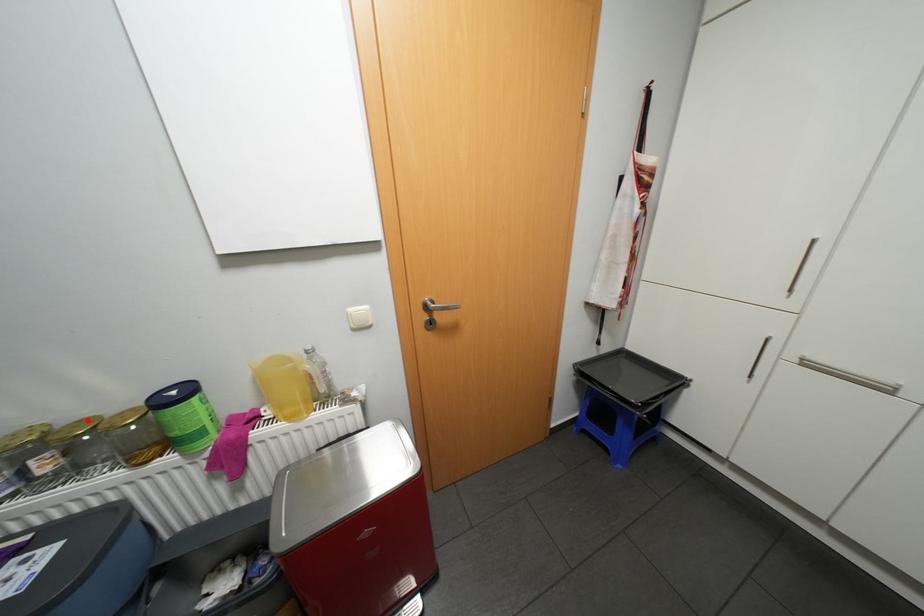
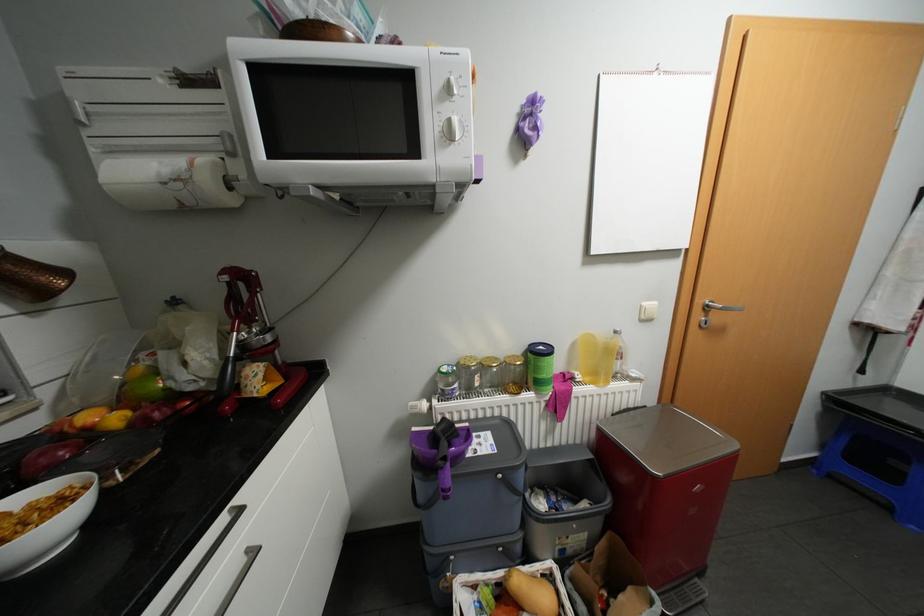
In the second image, find the point that corresponds to the highlighted location in the first image.

(495, 357)